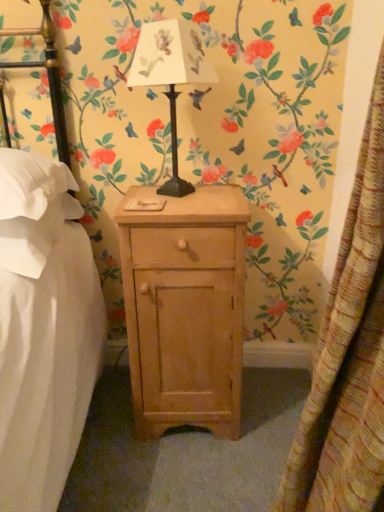
Question: Is textured yellow curtain at right not inside white fabric pillow at left, acting as the 1th pillow starting from the bottom?

Choices:
 (A) no
 (B) yes

Answer: (B)

Question: Considering the relative sizes of textured yellow curtain at right and white fabric pillow at left, the 2th pillow in the top-to-bottom sequence, in the image provided, is textured yellow curtain at right thinner than white fabric pillow at left, the 2th pillow in the top-to-bottom sequence,?

Choices:
 (A) yes
 (B) no

Answer: (A)

Question: From the image's perspective, does textured yellow curtain at right appear higher than white fabric pillow at left, the 2th pillow in the top-to-bottom sequence?

Choices:
 (A) yes
 (B) no

Answer: (B)

Question: Is textured yellow curtain at right aimed at white fabric pillow at left, the 2th pillow in the top-to-bottom sequence?

Choices:
 (A) no
 (B) yes

Answer: (A)

Question: From a real-world perspective, is textured yellow curtain at right physically below white fabric pillow at left, acting as the 1th pillow starting from the bottom?

Choices:
 (A) no
 (B) yes

Answer: (B)

Question: From a real-world perspective, relative to white fabric pillow at left, the 2th pillow in the top-to-bottom sequence, is textured yellow curtain at right vertically above or below?

Choices:
 (A) above
 (B) below

Answer: (B)

Question: Is point (349, 382) positioned closer to the camera than point (41, 245)?

Choices:
 (A) closer
 (B) farther

Answer: (A)

Question: Based on their positions, is textured yellow curtain at right located to the left or right of white fabric pillow at left, acting as the 1th pillow starting from the bottom?

Choices:
 (A) right
 (B) left

Answer: (A)

Question: From the image's perspective, relative to white fabric pillow at left, acting as the 1th pillow starting from the bottom, is textured yellow curtain at right above or below?

Choices:
 (A) above
 (B) below

Answer: (B)

Question: Considering their positions, is metallic black table lamp at center located in front of or behind white soft pillow at left, the 2th pillow from the bottom?

Choices:
 (A) front
 (B) behind

Answer: (B)

Question: From a real-world perspective, is metallic black table lamp at center physically located above or below white soft pillow at left, marked as the 1th pillow in a top-to-bottom arrangement?

Choices:
 (A) above
 (B) below

Answer: (A)

Question: From the image's perspective, is metallic black table lamp at center located above or below white soft pillow at left, the 2th pillow from the bottom?

Choices:
 (A) below
 (B) above

Answer: (B)

Question: From their relative heights in the image, would you say metallic black table lamp at center is taller or shorter than white soft pillow at left, marked as the 1th pillow in a top-to-bottom arrangement?

Choices:
 (A) short
 (B) tall

Answer: (B)

Question: Would you say white fabric pillow at left, the 2th pillow in the top-to-bottom sequence, is to the left or to the right of white soft pillow at left, the 2th pillow from the bottom, in the picture?

Choices:
 (A) right
 (B) left

Answer: (B)

Question: From the image's perspective, is white fabric pillow at left, the 2th pillow in the top-to-bottom sequence, positioned above or below white soft pillow at left, marked as the 1th pillow in a top-to-bottom arrangement?

Choices:
 (A) below
 (B) above

Answer: (A)